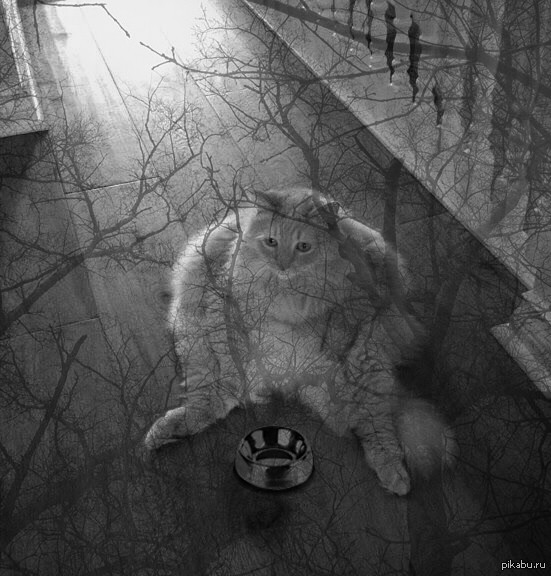
Find the location of a particular element. The image size is (551, 576). bowl is located at coordinates (264, 449).